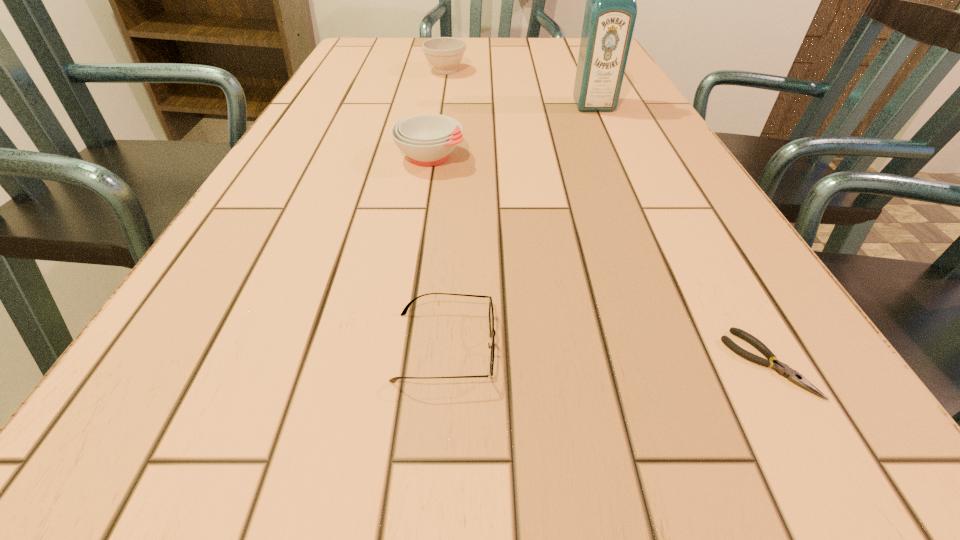
Where is `empty space between the spectacles and the nearer soup bowl`? The height and width of the screenshot is (540, 960). empty space between the spectacles and the nearer soup bowl is located at coordinates (438, 252).

The image size is (960, 540). I want to click on unoccupied area between the second farthest object and the third nearest object, so click(x=512, y=131).

The height and width of the screenshot is (540, 960). In order to click on free spot between the farthest object and the liquor in this screenshot , I will do tap(519, 88).

This screenshot has width=960, height=540. In order to click on free space between the nearer soup bowl and the farthest object in this screenshot , I will do [x=438, y=114].

The height and width of the screenshot is (540, 960). Find the location of `vacant space that is in between the spectacles and the farthest object`. vacant space that is in between the spectacles and the farthest object is located at coordinates (445, 208).

Image resolution: width=960 pixels, height=540 pixels. Identify the location of free space between the spectacles and the shortest object. (607, 355).

Identify the location of free space between the pliers and the third farthest object. (599, 260).

Where is `free space between the nearer soup bowl and the fourth nearest object`? free space between the nearer soup bowl and the fourth nearest object is located at coordinates (512, 131).

Where is `object that is the third closest to the shortest object`? object that is the third closest to the shortest object is located at coordinates (610, 13).

I want to click on the fourth closest object to the second farthest object, so click(x=782, y=369).